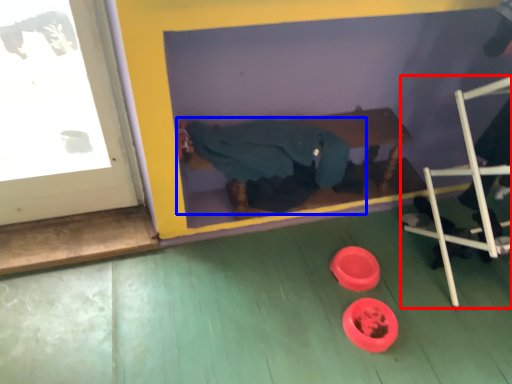
Question: Among these objects, which one is farthest to the camera, furniture (highlighted by a red box) or person (highlighted by a blue box)?

Choices:
 (A) furniture
 (B) person

Answer: (B)